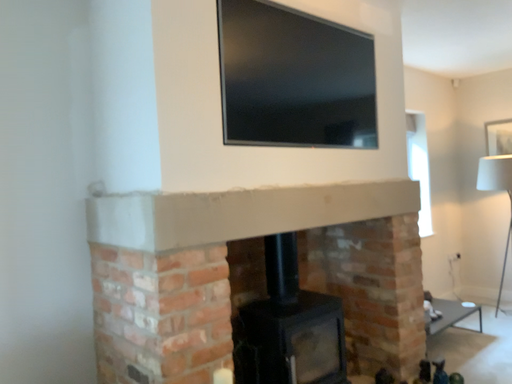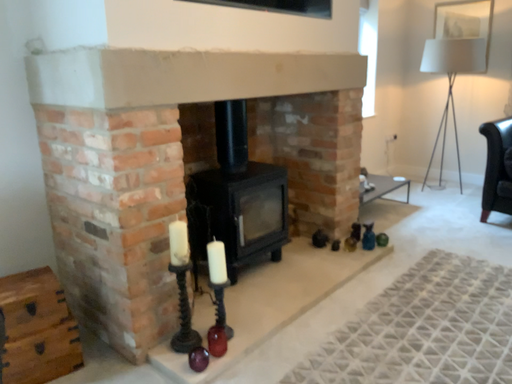
Question: Which way did the camera rotate in the video?

Choices:
 (A) rotated downward
 (B) rotated upward

Answer: (A)